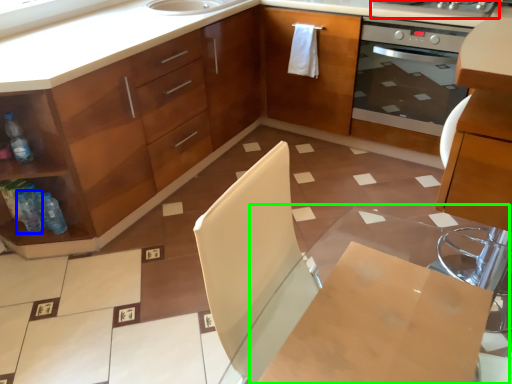
Question: Based on their relative distances, which object is farther from kitchen appliance (highlighted by a red box)? Choose from bottle (highlighted by a blue box) and table (highlighted by a green box).

Choices:
 (A) bottle
 (B) table

Answer: (A)